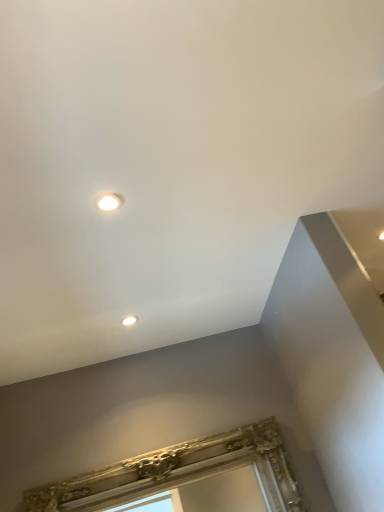
Question: Is there a large distance between matte white droplight at upper center, the 2th droplight from the top, and gold ornate frame at lower center?

Choices:
 (A) yes
 (B) no

Answer: (B)

Question: Considering the relative sizes of matte white droplight at upper center, the 2th droplight from the top, and gold ornate frame at lower center in the image provided, is matte white droplight at upper center, the 2th droplight from the top, thinner than gold ornate frame at lower center?

Choices:
 (A) no
 (B) yes

Answer: (B)

Question: Considering the relative sizes of matte white droplight at upper center, acting as the 1th droplight starting from the back, and gold ornate frame at lower center in the image provided, is matte white droplight at upper center, acting as the 1th droplight starting from the back, taller than gold ornate frame at lower center?

Choices:
 (A) yes
 (B) no

Answer: (B)

Question: Is matte white droplight at upper center, which is the first droplight from bottom to top, beside gold ornate frame at lower center?

Choices:
 (A) yes
 (B) no

Answer: (B)

Question: Is matte white droplight at upper center, the 2th droplight from the top, wider than gold ornate frame at lower center?

Choices:
 (A) no
 (B) yes

Answer: (A)

Question: Does point (129, 316) appear closer or farther from the camera than point (213, 438)?

Choices:
 (A) closer
 (B) farther

Answer: (A)

Question: From a real-world perspective, is matte white droplight at upper center, which is the first droplight from bottom to top, physically located above or below gold ornate frame at lower center?

Choices:
 (A) above
 (B) below

Answer: (A)

Question: In terms of size, does matte white droplight at upper center, the 2th droplight from the top, appear bigger or smaller than gold ornate frame at lower center?

Choices:
 (A) small
 (B) big

Answer: (A)

Question: Considering the positions of matte white droplight at upper center, which is the first droplight from bottom to top, and gold ornate frame at lower center in the image, is matte white droplight at upper center, which is the first droplight from bottom to top, taller or shorter than gold ornate frame at lower center?

Choices:
 (A) short
 (B) tall

Answer: (A)

Question: Would you say matte white droplight at upper center, the 2th droplight from the top, is inside or outside matte white droplight at upper center, which is the first droplight from top to bottom?

Choices:
 (A) inside
 (B) outside

Answer: (B)

Question: Is matte white droplight at upper center, which is the first droplight from bottom to top, bigger or smaller than matte white droplight at upper center, which is the first droplight from top to bottom?

Choices:
 (A) small
 (B) big

Answer: (A)

Question: From the image's perspective, is matte white droplight at upper center, which is the first droplight from bottom to top, above or below matte white droplight at upper center, acting as the first droplight starting from the front?

Choices:
 (A) above
 (B) below

Answer: (B)

Question: From a real-world perspective, is matte white droplight at upper center, which is the first droplight from bottom to top, above or below matte white droplight at upper center, which is the first droplight from top to bottom?

Choices:
 (A) below
 (B) above

Answer: (B)

Question: In the image, is matte white droplight at upper center, which is the first droplight from top to bottom, positioned in front of or behind gold ornate frame at lower center?

Choices:
 (A) behind
 (B) front

Answer: (B)

Question: Considering the positions of matte white droplight at upper center, acting as the first droplight starting from the front, and gold ornate frame at lower center in the image, is matte white droplight at upper center, acting as the first droplight starting from the front, taller or shorter than gold ornate frame at lower center?

Choices:
 (A) tall
 (B) short

Answer: (B)